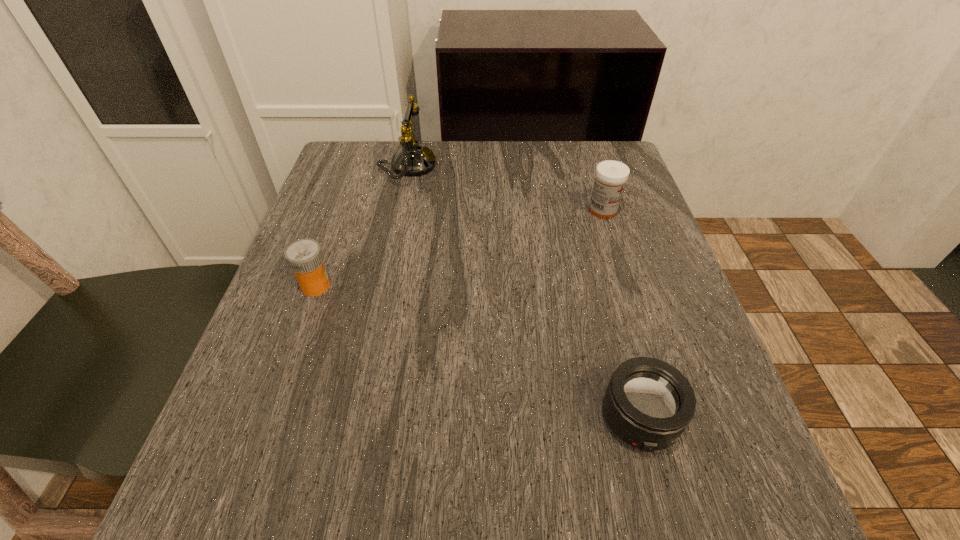
At what (x,y) coordinates should I click in order to perform the action: click on free space located on the label side of the second shortest object. Please return your answer as a coordinate pair (x, y). The height and width of the screenshot is (540, 960). Looking at the image, I should click on (541, 286).

Find the location of a particular element. object that is at the far edge is located at coordinates (412, 159).

Where is `telephone at the left edge`? The height and width of the screenshot is (540, 960). telephone at the left edge is located at coordinates (412, 159).

At what (x,y) coordinates should I click in order to perform the action: click on medicine present at the left edge. Please return your answer as a coordinate pair (x, y). Looking at the image, I should click on (304, 257).

Where is `medicine located in the right edge section of the desktop`? medicine located in the right edge section of the desktop is located at coordinates (611, 176).

Identify the location of telephoto lens positioned at the right edge. (648, 403).

In order to click on object positioned at the far left corner in this screenshot , I will do `click(412, 159)`.

The width and height of the screenshot is (960, 540). Identify the location of free space at the far edge of the desktop. (427, 188).

Find the location of a particular element. Image resolution: width=960 pixels, height=540 pixels. vacant space at the near edge of the desktop is located at coordinates (365, 480).

Locate an element on the screen. The height and width of the screenshot is (540, 960). vacant space at the left edge is located at coordinates (333, 343).